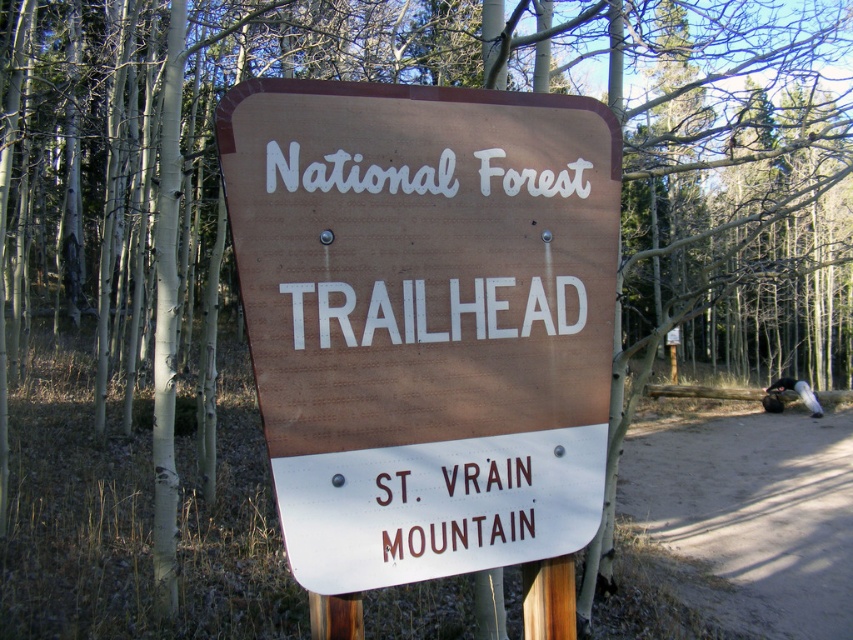
Is point (450, 340) closer to viewer compared to point (517, 467)?

Yes, it is in front of point (517, 467).

Is white painted wood at center taller than brown/material sign at lower center?

No.

Between point (534, 305) and point (459, 529), which one is positioned in front?

Point (459, 529)

At what (x,y) coordinates should I click in order to perform the action: click on white painted wood at center. Please return your answer as a coordinate pair (x, y). Looking at the image, I should click on (426, 310).

How far apart are brown wood trailhead sign at center and dirt path at lower right?

brown wood trailhead sign at center and dirt path at lower right are 4.86 meters apart.

Which is behind, point (320, 378) or point (689, 420)?

The point (689, 420) is behind.

You are a GUI agent. You are given a task and a screenshot of the screen. Output one action in this format:
    pyautogui.click(x=<x>, y=<y>)
    Task: Click on the brown wood trailhead sign at center
    
    Given the screenshot: What is the action you would take?
    pyautogui.click(x=425, y=320)

Is point (700, 486) closer to camera compared to point (442, 529)?

No, (700, 486) is behind (442, 529).

Is the position of dirt path at lower right more distant than that of brown/material sign at lower center?

Yes, it is behind brown/material sign at lower center.

Which is in front, point (793, 500) or point (402, 484)?

Point (402, 484)

Find the location of a particular element. This screenshot has height=640, width=853. dirt path at lower right is located at coordinates (750, 515).